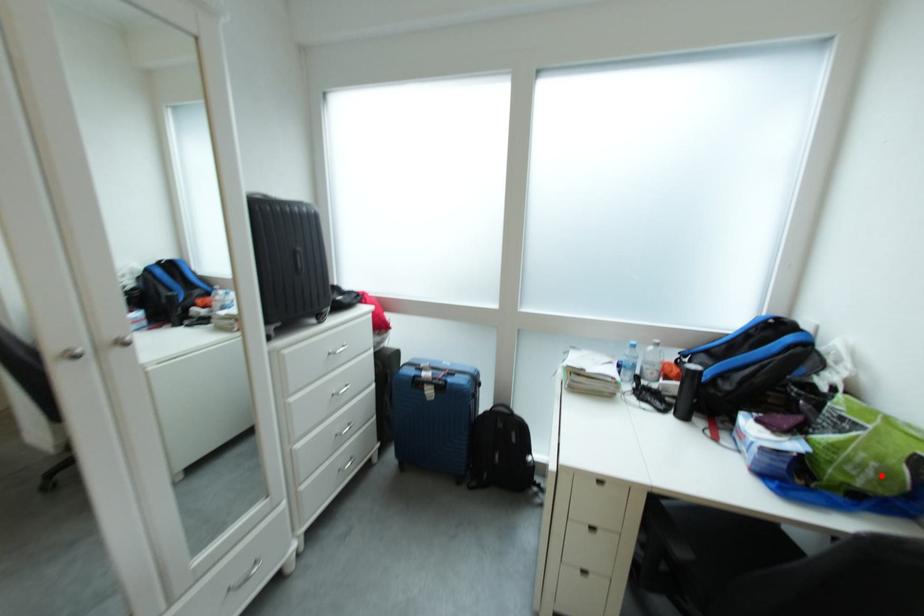
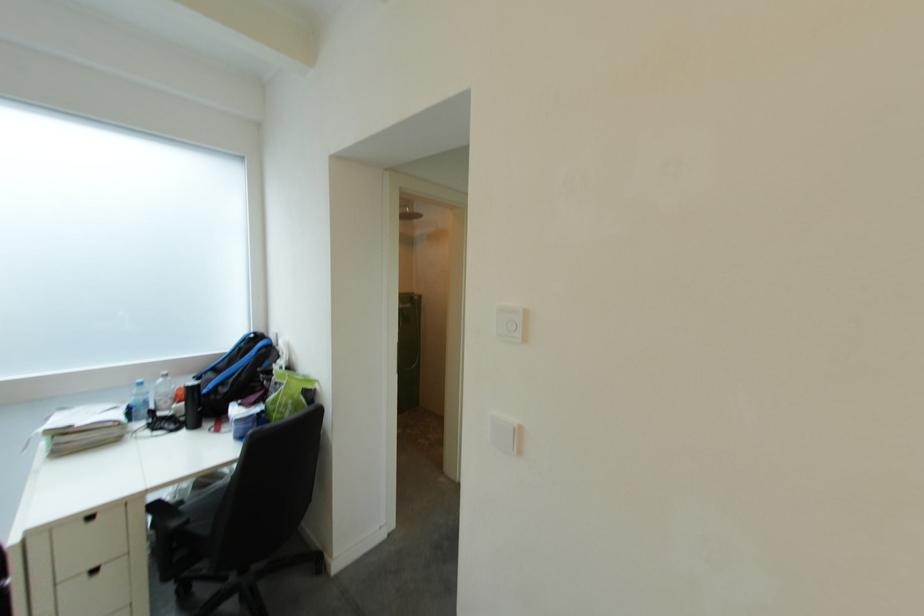
Locate, in the second image, the point that corresponds to the highlighted location in the first image.

(301, 410)